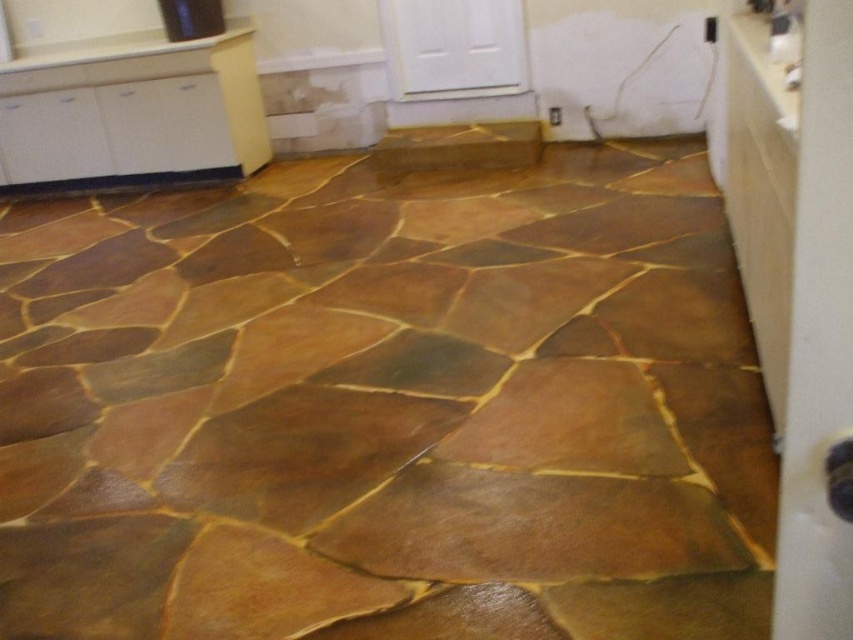
Can you confirm if brown polished stone at center is taller than white glossy counter top at upper left?

Yes, brown polished stone at center is taller than white glossy counter top at upper left.

Is brown polished stone at center behind white glossy counter top at upper left?

No, brown polished stone at center is in front of white glossy counter top at upper left.

Describe the element at coordinates (386, 406) in the screenshot. I see `brown polished stone at center` at that location.

Find the location of a particular element. This screenshot has width=853, height=640. brown polished stone at center is located at coordinates (386, 406).

This screenshot has height=640, width=853. What do you see at coordinates (386, 406) in the screenshot? I see `brown polished stone at center` at bounding box center [386, 406].

Between point (611, 176) and point (785, 120), which one is positioned in front?

Point (785, 120)

Where is `brown polished stone at center`? brown polished stone at center is located at coordinates (386, 406).

Find the location of a particular element. The image size is (853, 640). brown polished stone at center is located at coordinates [386, 406].

Could you measure the distance between white glossy counter top at upper right and white glossy counter top at upper left?

3.55 meters

Between white glossy counter top at upper right and white glossy counter top at upper left, which one appears on the left side from the viewer's perspective?

white glossy counter top at upper left is more to the left.

This screenshot has width=853, height=640. Describe the element at coordinates (772, 58) in the screenshot. I see `white glossy counter top at upper right` at that location.

Locate an element on the screen. Image resolution: width=853 pixels, height=640 pixels. white glossy counter top at upper right is located at coordinates (772, 58).